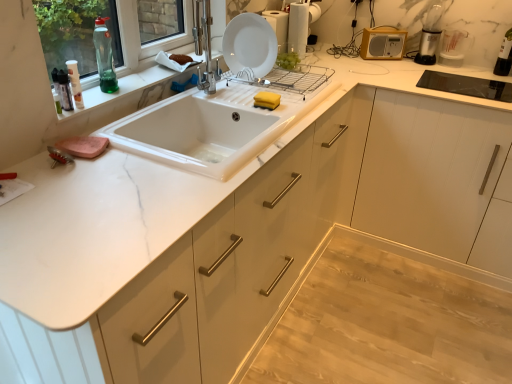
Question: Is transparent plastic bottle at upper right, marked as the third bottle in a bottom-to-top arrangement, touching yellow matte radio at upper right, which is the second appliance in right-to-left order?

Choices:
 (A) no
 (B) yes

Answer: (A)

Question: From the image's perspective, would you say transparent plastic bottle at upper right, which appears as the 1th bottle when viewed from the back, is positioned over yellow matte radio at upper right, the 1th appliance from the left?

Choices:
 (A) no
 (B) yes

Answer: (A)

Question: Is the position of transparent plastic bottle at upper right, which appears as the 1th bottle when viewed from the back, more distant than that of yellow matte radio at upper right, which is the second appliance in right-to-left order?

Choices:
 (A) no
 (B) yes

Answer: (A)

Question: From the image's perspective, is transparent plastic bottle at upper right, which is counted as the 1th bottle, starting from the top, located beneath yellow matte radio at upper right, which is the second appliance in right-to-left order?

Choices:
 (A) no
 (B) yes

Answer: (B)

Question: Considering the relative sizes of transparent plastic bottle at upper right, which appears as the 1th bottle when viewed from the back, and yellow matte radio at upper right, which is the second appliance in right-to-left order, in the image provided, is transparent plastic bottle at upper right, which appears as the 1th bottle when viewed from the back, wider than yellow matte radio at upper right, which is the second appliance in right-to-left order,?

Choices:
 (A) yes
 (B) no

Answer: (A)

Question: Is translucent plastic spray bottle at upper left, placed as the 1th bottle when sorted from left to right, wider or thinner than transparent plastic measuring cup at upper right, the 2th appliance in the left-to-right sequence?

Choices:
 (A) thin
 (B) wide

Answer: (A)

Question: From the image's perspective, is translucent plastic spray bottle at upper left, the third bottle positioned from the right, above or below transparent plastic measuring cup at upper right, which ranks as the first appliance in right-to-left order?

Choices:
 (A) above
 (B) below

Answer: (B)

Question: In terms of size, does translucent plastic spray bottle at upper left, placed as the 1th bottle when sorted from left to right, appear bigger or smaller than transparent plastic measuring cup at upper right, the 2th appliance in the left-to-right sequence?

Choices:
 (A) small
 (B) big

Answer: (A)

Question: From a real-world perspective, is translucent plastic spray bottle at upper left, marked as the third bottle in a back-to-front arrangement, positioned above or below transparent plastic measuring cup at upper right, which ranks as the first appliance in right-to-left order?

Choices:
 (A) below
 (B) above

Answer: (B)

Question: From a real-world perspective, relative to transparent plastic measuring cup at upper right, which ranks as the first appliance in right-to-left order, is transparent plastic bottle at upper right, which is counted as the 1th bottle, starting from the top, vertically above or below?

Choices:
 (A) below
 (B) above

Answer: (B)

Question: Considering the positions of transparent plastic bottle at upper right, marked as the third bottle in a bottom-to-top arrangement, and transparent plastic measuring cup at upper right, the 2th appliance in the left-to-right sequence, in the image, is transparent plastic bottle at upper right, marked as the third bottle in a bottom-to-top arrangement, wider or thinner than transparent plastic measuring cup at upper right, the 2th appliance in the left-to-right sequence,?

Choices:
 (A) wide
 (B) thin

Answer: (B)

Question: Is transparent plastic bottle at upper right, which appears as the 1th bottle when viewed from the back, taller or shorter than transparent plastic measuring cup at upper right, the 2th appliance in the left-to-right sequence?

Choices:
 (A) short
 (B) tall

Answer: (B)

Question: From the image's perspective, is transparent plastic bottle at upper right, which is counted as the 3th bottle, starting from the left, above or below transparent plastic measuring cup at upper right, which ranks as the first appliance in right-to-left order?

Choices:
 (A) above
 (B) below

Answer: (B)

Question: Does point click(460, 44) appear closer or farther from the camera than point click(339, 243)?

Choices:
 (A) farther
 (B) closer

Answer: (B)

Question: Considering the positions of transparent plastic measuring cup at upper right, the 2th appliance in the left-to-right sequence, and light wood floor at lower right in the image, is transparent plastic measuring cup at upper right, the 2th appliance in the left-to-right sequence, bigger or smaller than light wood floor at lower right?

Choices:
 (A) big
 (B) small

Answer: (B)